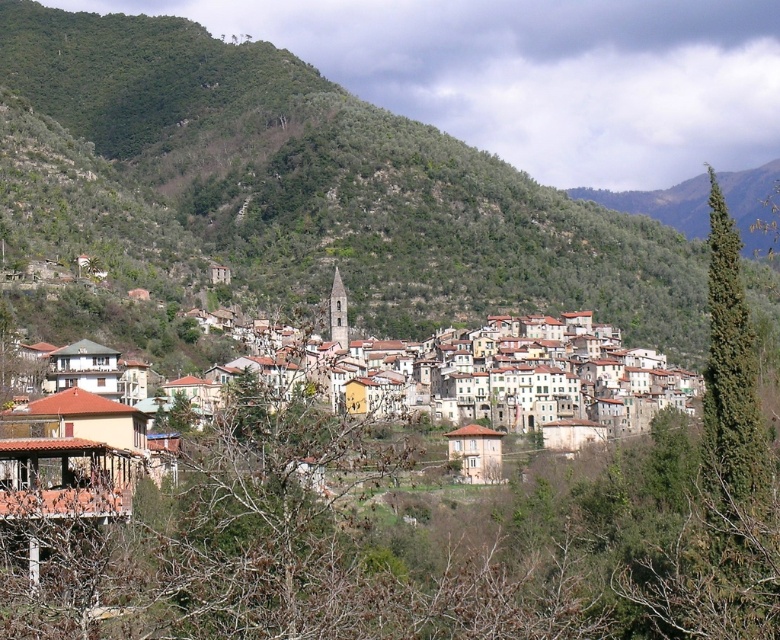
You are a hiker standing at the base of the green leafy hillside at center and want to reach the green coniferous tree at right. Given that the average walking speed is 3 miles per hour, how long would it take to walk directly to the tree?

The green leafy hillside at center and green coniferous tree at right are 441.62 feet apart. Converting feet to miles, 441.62 feet is approximately 0.0837 miles. At a walking speed of 3 mph, the time required would be roughly 0.0837 miles divided by 3 mph, which equals approximately 0.0279 hours. Converting hours to minutes, this is about 1.67 minutes, so roughly 1 minute and 40 seconds.

You are planning to build a small cabin and want to choose between the green leafy hillside at center and the green coniferous tree at right for a view. Which location offers a higher elevation for a better vantage point?

The green leafy hillside at center offers a higher elevation for a better vantage point since it has a greater height compared to the green coniferous tree at right.